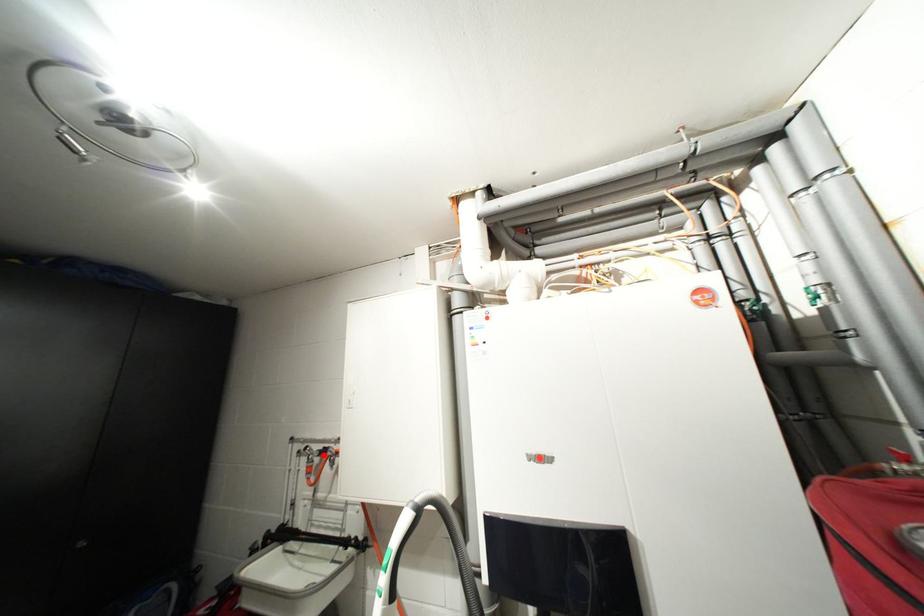
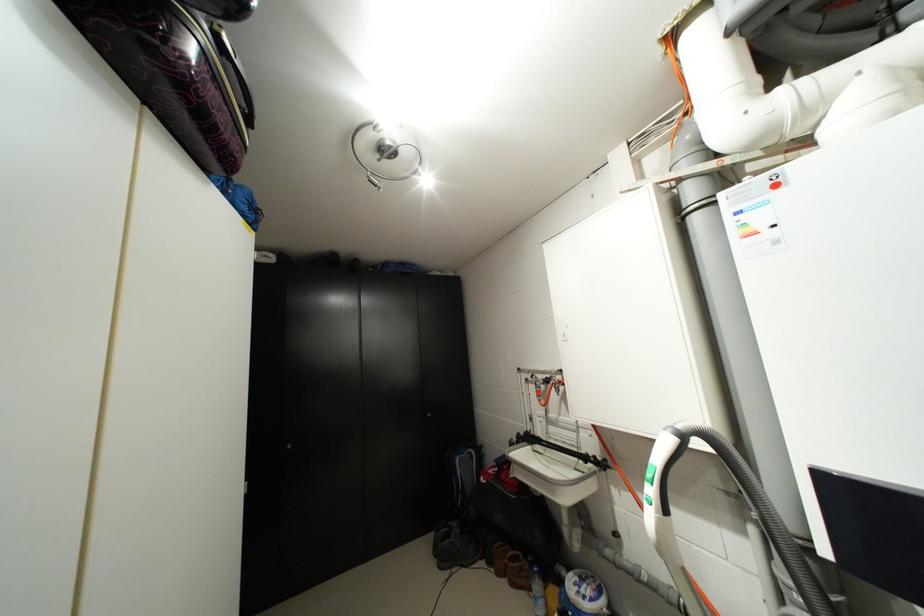
Locate, in the second image, the point that corresponds to the highlighted location in the first image.

(549, 383)